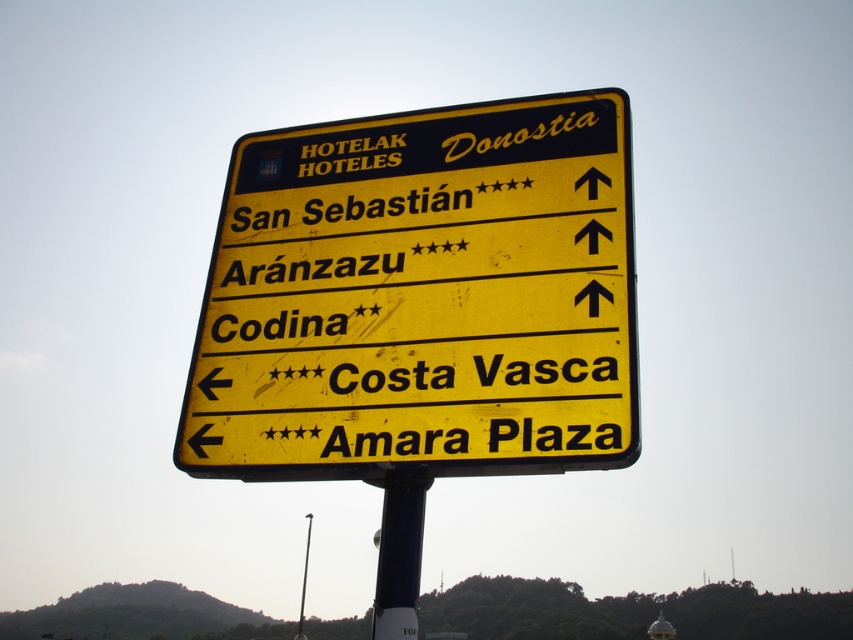
Question: Is blue metallic pole at center to the left of metallic pole at center from the viewer's perspective?

Choices:
 (A) no
 (B) yes

Answer: (A)

Question: Which of the following is the closest to the observer?

Choices:
 (A) blue metallic pole at center
 (B) yellow matte sign at center

Answer: (B)

Question: Among these points, which one is farthest from the camera?

Choices:
 (A) (305, 570)
 (B) (463, 176)

Answer: (A)

Question: Can you confirm if yellow matte sign at center is positioned below blue metallic pole at center?

Choices:
 (A) no
 (B) yes

Answer: (A)

Question: Does blue metallic pole at center appear on the right side of metallic pole at center?

Choices:
 (A) yes
 (B) no

Answer: (A)

Question: Estimate the real-world distances between objects in this image. Which object is farther from the blue metallic pole at center?

Choices:
 (A) yellow matte sign at center
 (B) metallic pole at center

Answer: (B)